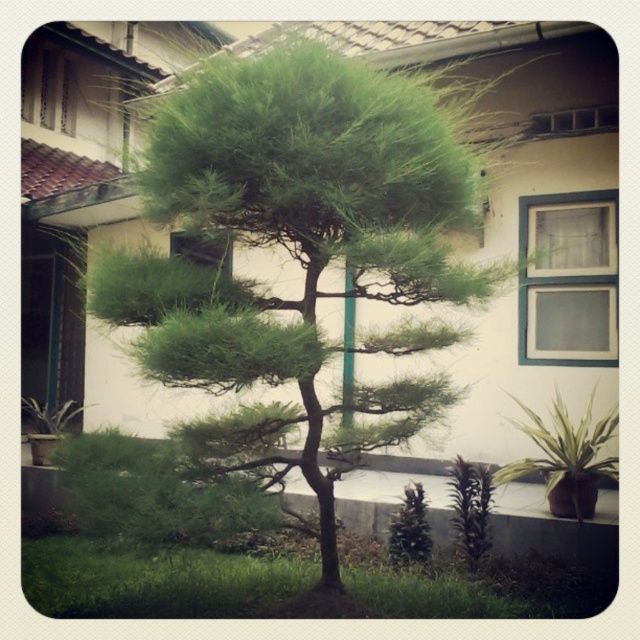
You are standing at the center of the image and want to place a new decorative item. If you look towards the direction of the green leafy plant at lower right, which direction should you face?

The green leafy plant at lower right is located at coordinates 0.714 on the x and 0.884 on the y axis. Since the lower right corner of the image is typically the bottom right quadrant, facing towards the lower right would mean turning your body to face the bottom right direction. Therefore, to face the direction of the green leafy plant at lower right, you should turn your body to face the bottom right direction.

You are a gardener who wants to plant a new tree in your backyard. You have two options from the image, the green leafy tree at center and the green leafy plant at lower right. Which one requires more space to grow?

The green leafy tree at center requires more space to grow since it is bigger than the green leafy plant at lower right.